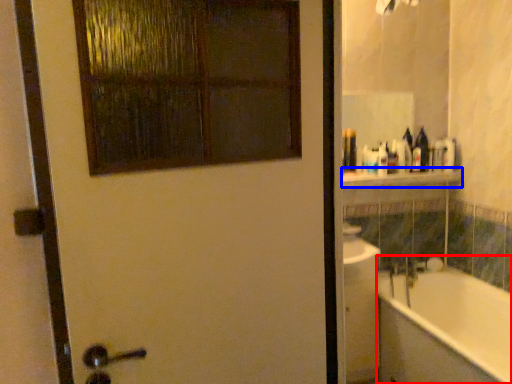
Question: Which object appears closest to the camera in this image, bathtub (highlighted by a red box) or balustrade (highlighted by a blue box)?

Choices:
 (A) bathtub
 (B) balustrade

Answer: (A)